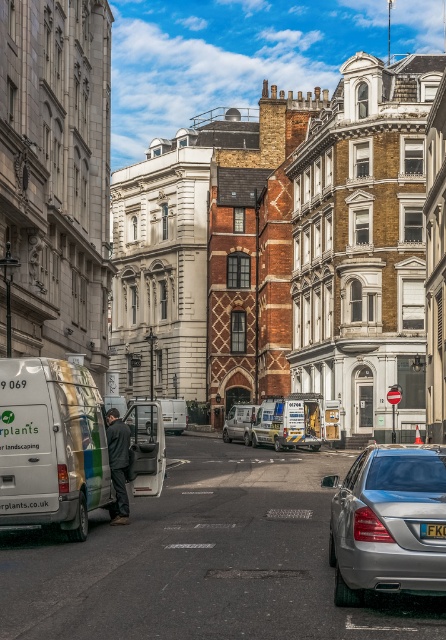
Based on the photo, can you confirm if white metallic van at lower left is thinner than satin silver sedan at lower right?

Indeed, white metallic van at lower left has a lesser width compared to satin silver sedan at lower right.

Describe the element at coordinates (52, 445) in the screenshot. Image resolution: width=446 pixels, height=640 pixels. I see `white metallic van at lower left` at that location.

Is point (42, 388) farther from camera compared to point (405, 572)?

Yes, point (42, 388) is farther from viewer.

The height and width of the screenshot is (640, 446). What are the coordinates of `white metallic van at lower left` in the screenshot? It's located at (52, 445).

Who is more distant from viewer, (11, 435) or (288, 442)?

Point (288, 442)

Is point (61, 435) closer to camera compared to point (308, 444)?

Yes, it is.

Who is more forward, (13,369) or (312,429)?

Point (13,369) is more forward.

Identify the location of white metallic van at lower left. This screenshot has width=446, height=640. (52, 445).

Does dark gray jacket at center lie in front of black plastic license plate at center?

No, it is not.

From the picture: Can you confirm if dark gray jacket at center is positioned below black plastic license plate at center?

Yes, dark gray jacket at center is below black plastic license plate at center.

Does point (119, 422) come in front of point (445, 529)?

No, it is behind (445, 529).

Locate an element on the screen. dark gray jacket at center is located at coordinates (118, 461).